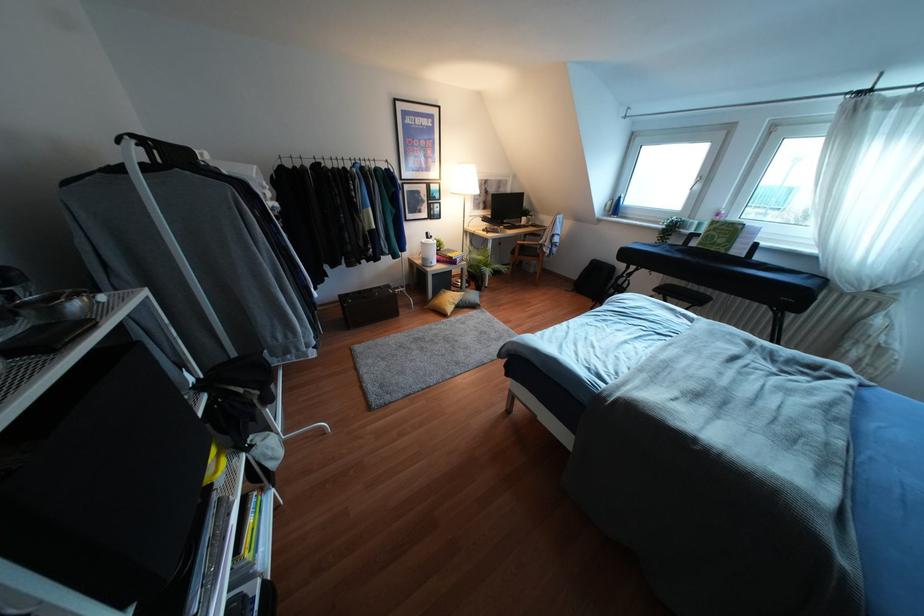
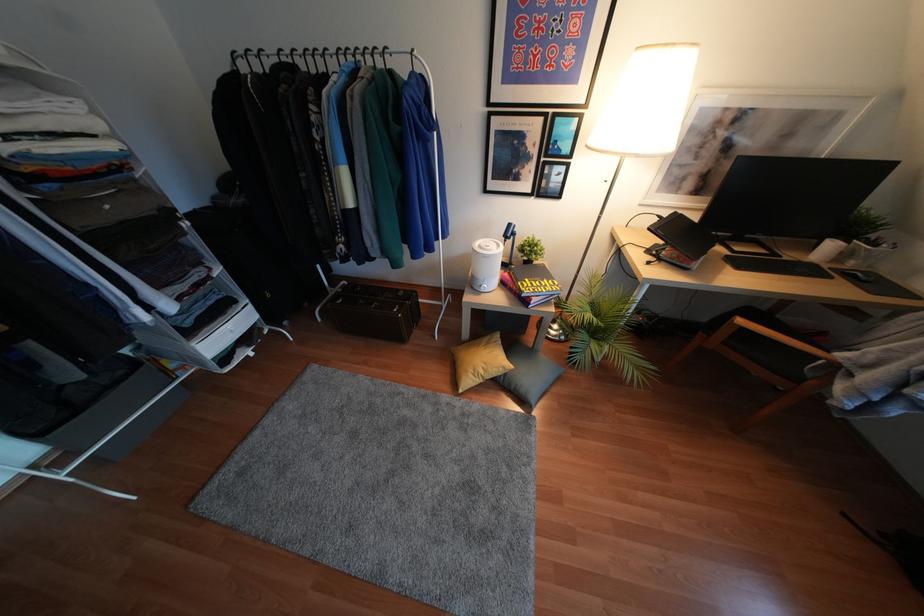
Find the pixel in the second image that matches point 438,238 in the first image.

(536, 237)